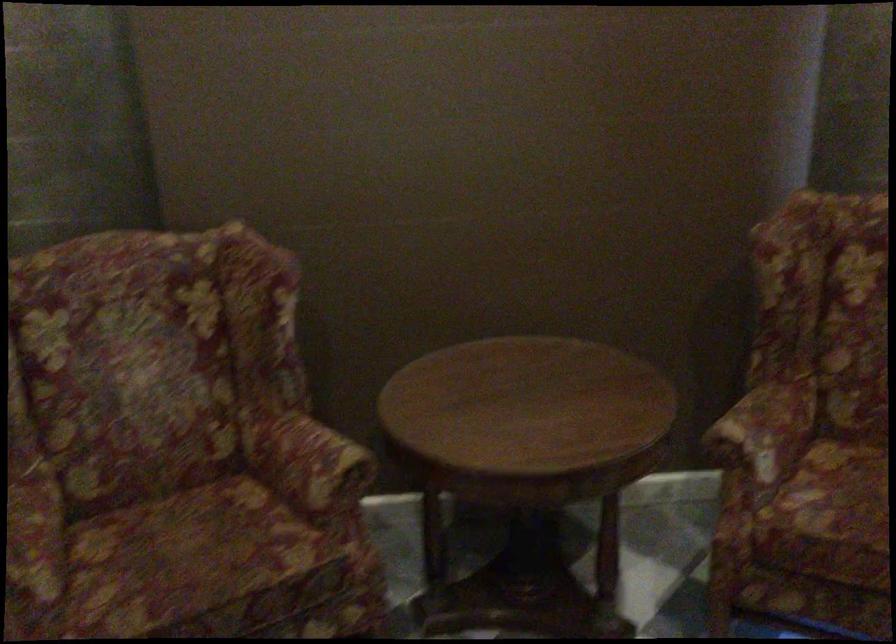
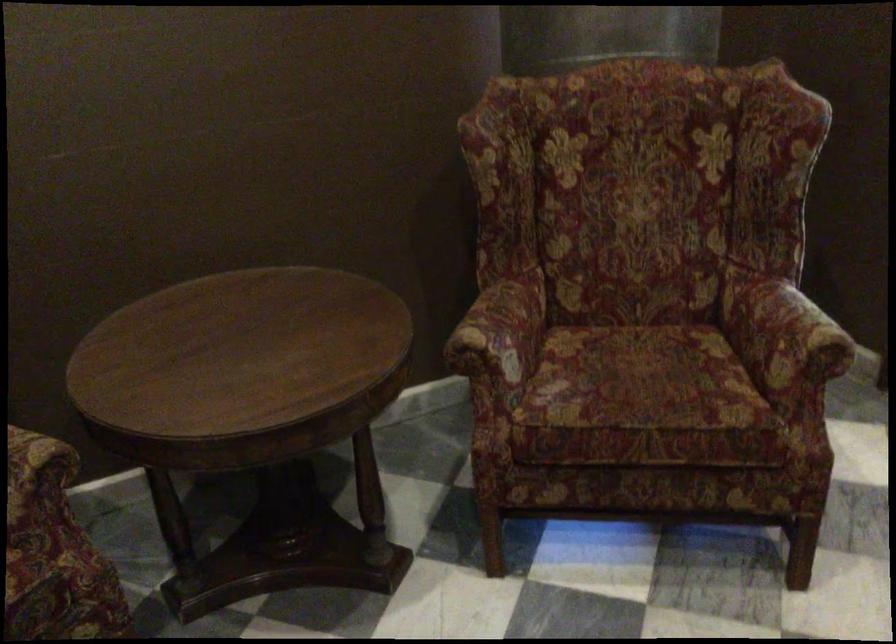
Where in the second image is the point corresponding to (x=762, y=430) from the first image?

(501, 330)